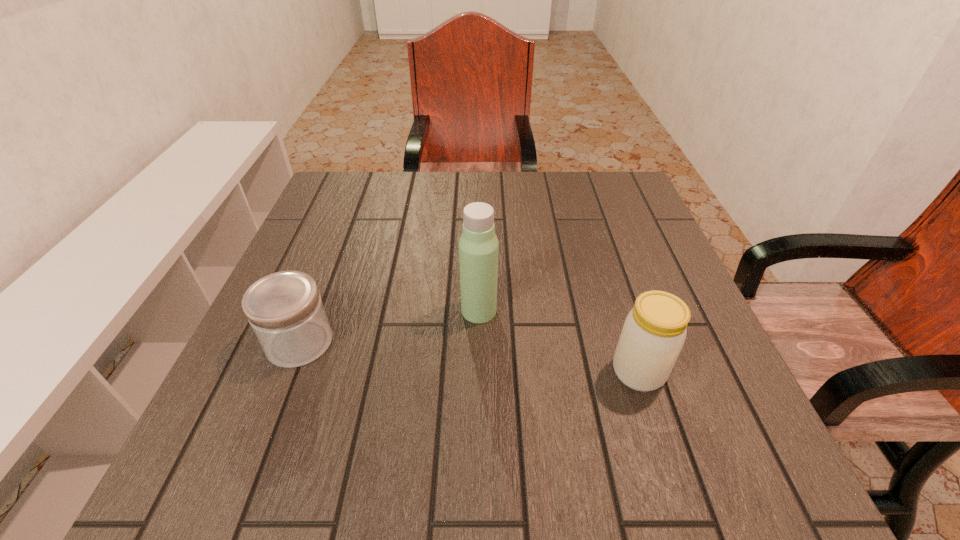
I want to click on object that is at the right edge, so click(x=654, y=332).

The height and width of the screenshot is (540, 960). In the image, there is a desktop. What are the coordinates of `vacant space at the far edge` in the screenshot? It's located at (438, 216).

In the image, there is a desktop. Where is `vacant area at the near edge`? The width and height of the screenshot is (960, 540). vacant area at the near edge is located at coordinates (589, 464).

At what (x,y) coordinates should I click in order to perform the action: click on free space at the left edge of the desktop. Please return your answer as a coordinate pair (x, y). The height and width of the screenshot is (540, 960). Looking at the image, I should click on (333, 245).

Find the location of a particular element. This screenshot has width=960, height=540. blank space at the right edge of the desktop is located at coordinates (647, 226).

Where is `vacant space at the far left corner of the desktop`? The height and width of the screenshot is (540, 960). vacant space at the far left corner of the desktop is located at coordinates tap(360, 205).

Where is `free location at the near left corner`? free location at the near left corner is located at coordinates (264, 453).

I want to click on free space between the thermos bottle and the shorter jar, so click(389, 327).

Where is `free point between the thermos bottle and the shortest object`? Image resolution: width=960 pixels, height=540 pixels. free point between the thermos bottle and the shortest object is located at coordinates (389, 327).

This screenshot has height=540, width=960. Identify the location of free space between the thermos bottle and the left jar. coord(389,327).